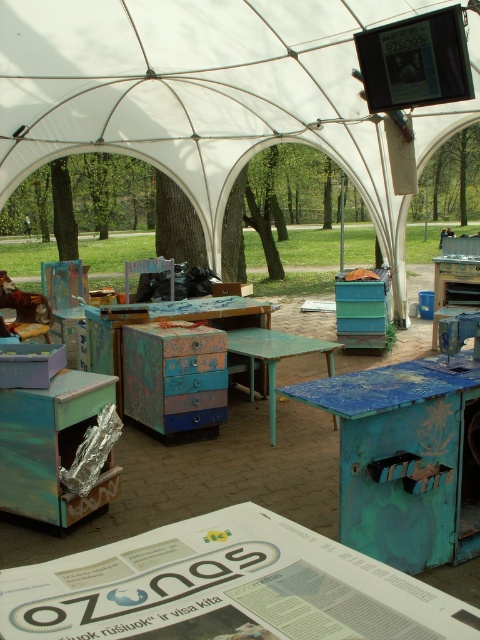
Question: Among these points, which one is farthest from the camera?

Choices:
 (A) (278, 40)
 (B) (263, 339)

Answer: (A)

Question: Which point is farther to the camera?

Choices:
 (A) (420, 381)
 (B) (305, 340)
 (C) (325, 76)
 (D) (87, 500)

Answer: (C)

Question: Can you confirm if metallic blue drawer at lower left is positioned below teal painted wood table at center?

Choices:
 (A) no
 (B) yes

Answer: (B)

Question: Which point appears closest to the camera in this image?

Choices:
 (A) (430, 516)
 (B) (271, 342)
 (C) (16, 470)

Answer: (A)

Question: Is blue painted wood table at center above teal painted wood table at center?

Choices:
 (A) no
 (B) yes

Answer: (A)

Question: Considering the relative positions of white fabric canopy at center and metallic blue drawer at lower left in the image provided, where is white fabric canopy at center located with respect to metallic blue drawer at lower left?

Choices:
 (A) right
 (B) left

Answer: (A)